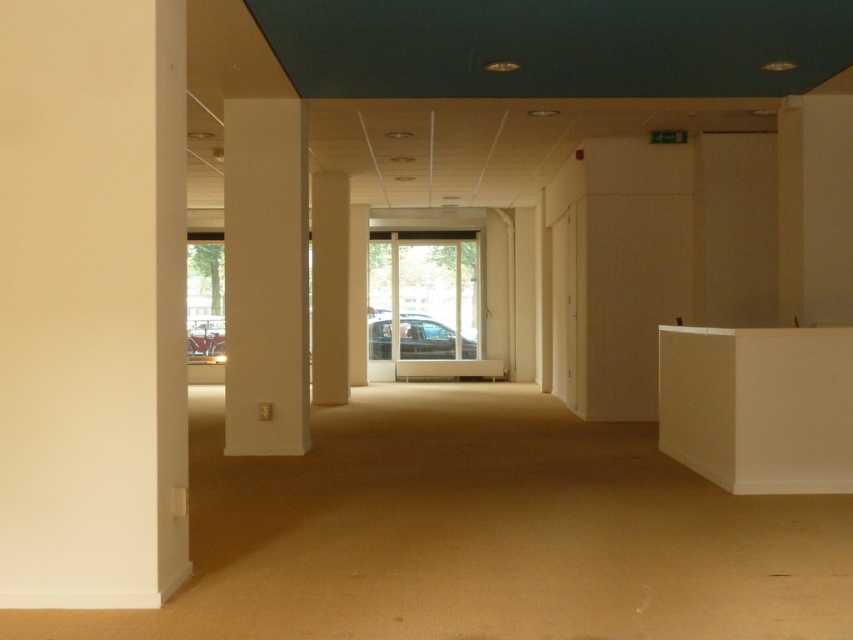
Between white smooth pillar at left and white glossy pillar at center, which one has more height?

Standing taller between the two is white glossy pillar at center.

Does point (300, 305) come behind point (325, 173)?

No, (300, 305) is in front of (325, 173).

Locate an element on the screen. white smooth pillar at left is located at coordinates (265, 276).

Between white matte reception desk at right and white smooth pillar at left, which one has less height?

With less height is white matte reception desk at right.

Is point (776, 355) farther from viewer compared to point (297, 218)?

No.

This screenshot has width=853, height=640. In order to click on white matte reception desk at right in this screenshot , I will do `click(758, 406)`.

Does white matte reception desk at right have a lesser width compared to metallic silver car at center?

Indeed, white matte reception desk at right has a lesser width compared to metallic silver car at center.

Can you confirm if white matte reception desk at right is positioned to the left of metallic silver car at center?

No, white matte reception desk at right is not to the left of metallic silver car at center.

Is point (844, 394) in front of point (451, 330)?

Yes, point (844, 394) is in front of point (451, 330).

Identify the location of white matte reception desk at right. (758, 406).